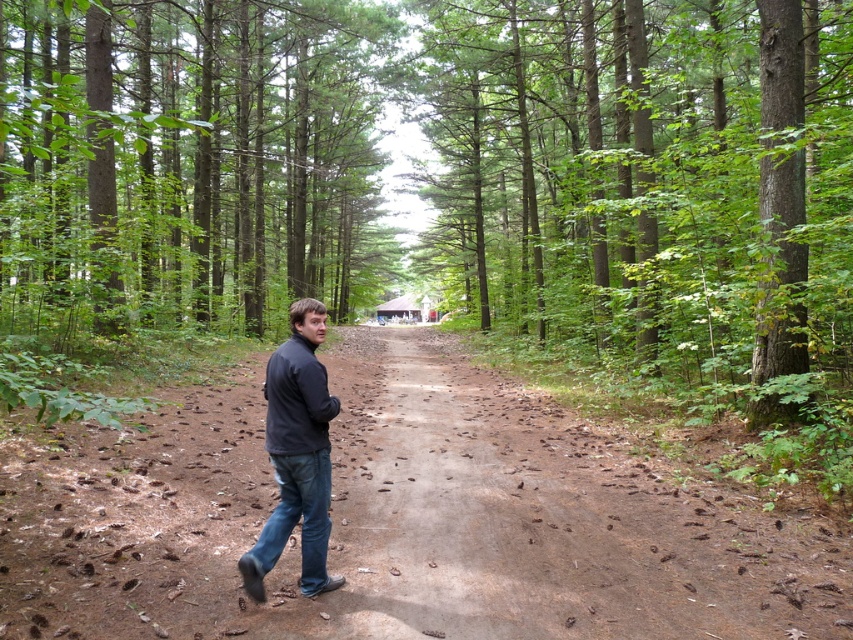
Question: Which of the following is the closest to the observer?

Choices:
 (A) blue denim jeans at center
 (B) dark blue fleece at center
 (C) brown dirt road at center

Answer: (C)

Question: Which object is the farthest from the blue denim jeans at center?

Choices:
 (A) brown dirt road at center
 (B) green rough bark tree at center
 (C) dark blue fleece at center
 (D) green matte tree at center

Answer: (D)

Question: Is brown dirt road at center to the left of blue denim jeans at center from the viewer's perspective?

Choices:
 (A) yes
 (B) no

Answer: (B)

Question: Does brown dirt road at center appear under dark blue fleece at center?

Choices:
 (A) no
 (B) yes

Answer: (B)

Question: Which of these objects is positioned closest to the dark blue fleece at center?

Choices:
 (A) blue denim jeans at center
 (B) green rough bark tree at center
 (C) brown dirt road at center

Answer: (A)

Question: Can you confirm if brown dirt road at center is bigger than green matte tree at center?

Choices:
 (A) no
 (B) yes

Answer: (A)